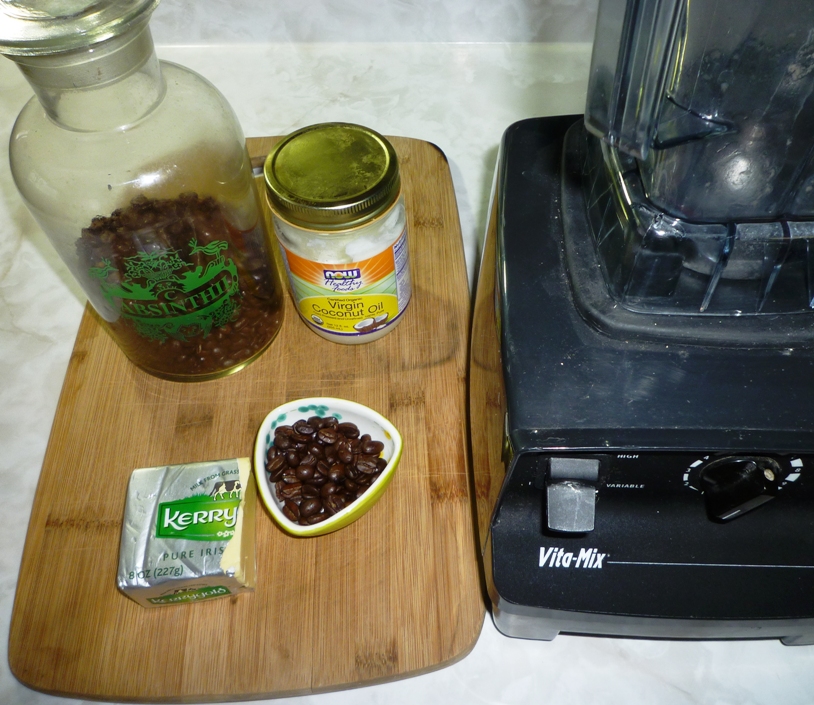
The image size is (814, 705). I want to click on jar, so click(x=313, y=237).